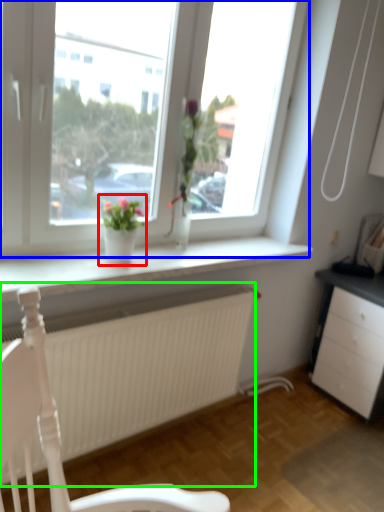
Question: Which object is the closest to the houseplant (highlighted by a red box)? Choose among these: window (highlighted by a blue box) or carpets (highlighted by a green box).

Choices:
 (A) window
 (B) carpets

Answer: (A)